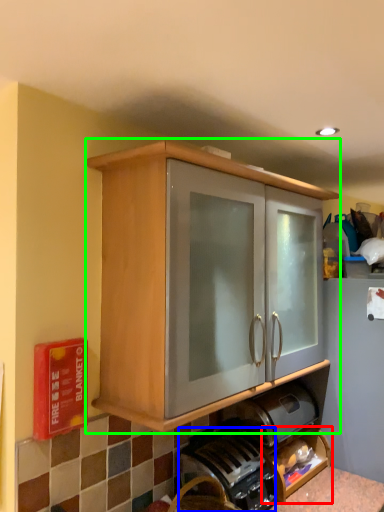
Question: Based on their relative distances, which object is farther from shelf (highlighted by a red box)? Choose from coffee machine (highlighted by a blue box) and cabinetry (highlighted by a green box).

Choices:
 (A) coffee machine
 (B) cabinetry

Answer: (B)